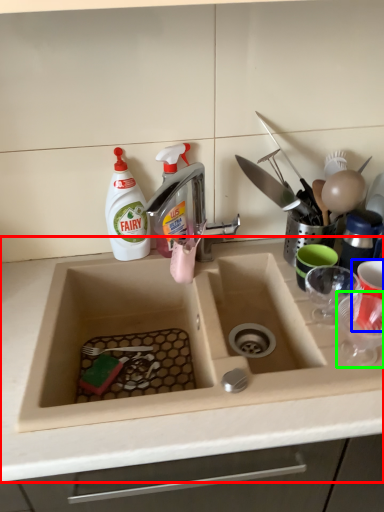
Question: Which object is positioned farthest from countertop (highlighted by a red box)? Select from tableware (highlighted by a blue box) and tableware (highlighted by a green box).

Choices:
 (A) tableware
 (B) tableware

Answer: (A)